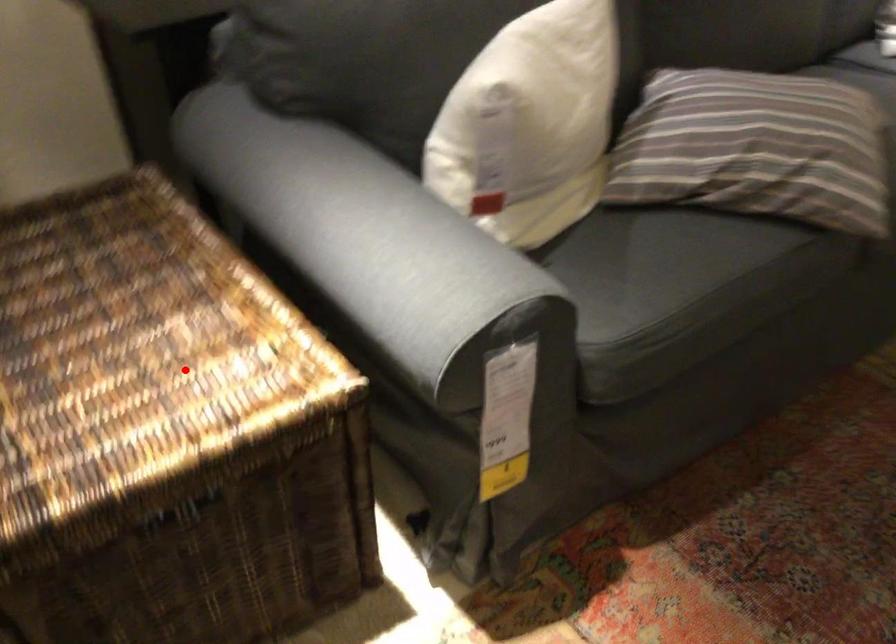
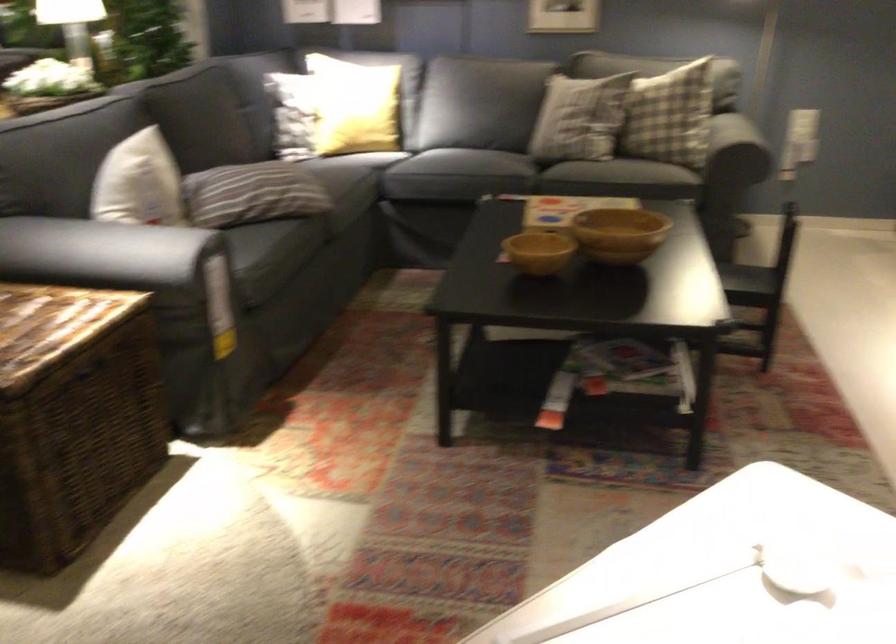
Question: I am providing you with two images of the same scene from different viewpoints. Given a red point in image1, look at the same physical point in image2. Is it:

Choices:
 (A) Closer to the viewpoint
 (B) Farther from the viewpoint

Answer: (B)